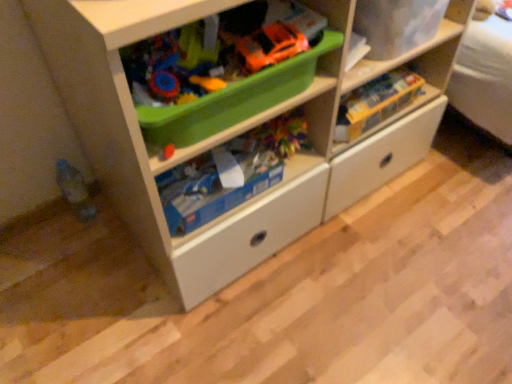
Where is `free space on the front side of matte plastic toy at lower left, the third toy from the right`? The image size is (512, 384). free space on the front side of matte plastic toy at lower left, the third toy from the right is located at coordinates (72, 260).